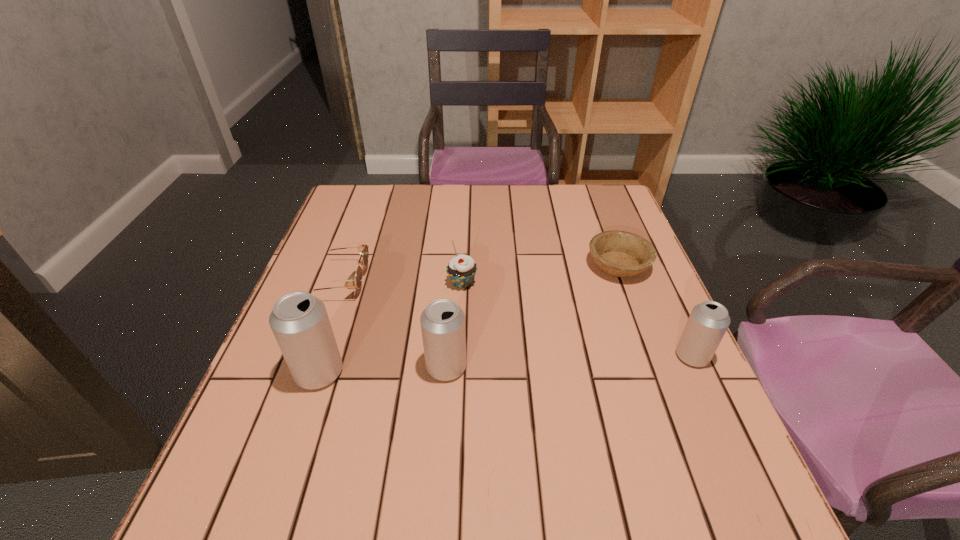
To make them evenly spaced by inserting another beer_can among them, please locate a vacant spot for this new beer_can. Please provide its 2D coordinates. Your answer should be formatted as a tuple, i.e. [(x, y)], where the tuple contains the x and y coordinates of a point satisfying the conditions above.

[(570, 361)]